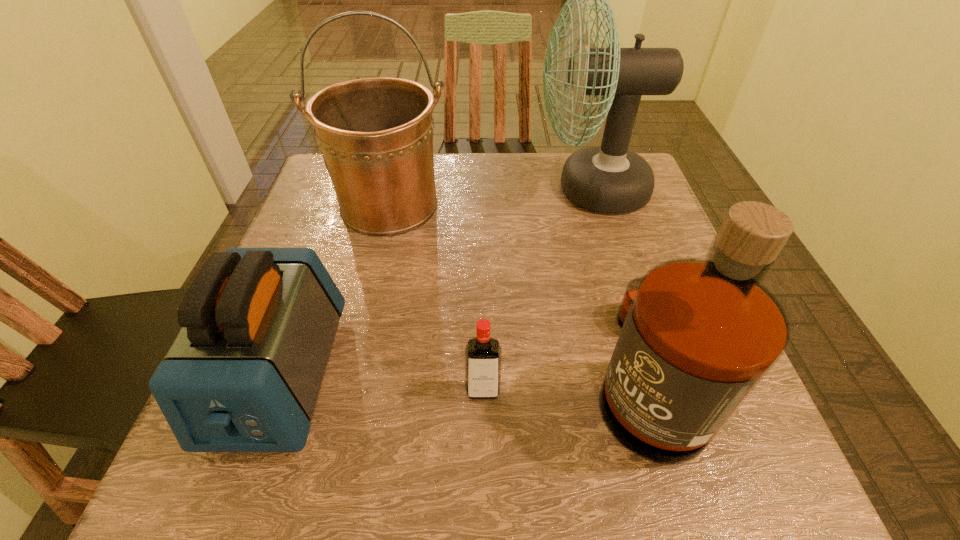
The height and width of the screenshot is (540, 960). Find the location of `fan situated at the right edge`. fan situated at the right edge is located at coordinates (609, 178).

Identify the location of liquor present at the right edge. (698, 335).

Find the location of a particular element. The image size is (960, 540). object located at the far left corner is located at coordinates (375, 134).

Where is `object that is at the near left corner`? The image size is (960, 540). object that is at the near left corner is located at coordinates (244, 373).

Where is `object positioned at the far right corner`? The image size is (960, 540). object positioned at the far right corner is located at coordinates (609, 178).

This screenshot has height=540, width=960. Find the location of `object located at the near right corner`. object located at the near right corner is located at coordinates (698, 335).

You are a GUI agent. You are given a task and a screenshot of the screen. Output one action in this format:
    pyautogui.click(x=<x>, y=<y>)
    Task: Click on the vacant space at the far edge of the desktop
    
    Given the screenshot: What is the action you would take?
    pyautogui.click(x=505, y=161)

Find the location of `vacant space at the near edge of the desktop`. vacant space at the near edge of the desktop is located at coordinates (381, 462).

Identify the location of free space at the left edge of the desktop. This screenshot has width=960, height=540. (323, 208).

Find the location of `vacant area at the right edge`. vacant area at the right edge is located at coordinates (613, 226).